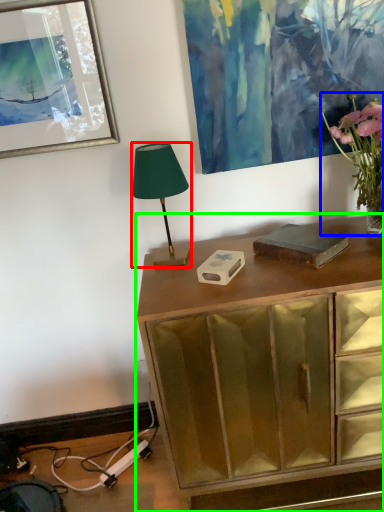
Question: Which is nearer to the lamp (highlighted by a red box)? houseplant (highlighted by a blue box) or chest of drawers (highlighted by a green box).

Choices:
 (A) houseplant
 (B) chest of drawers

Answer: (B)